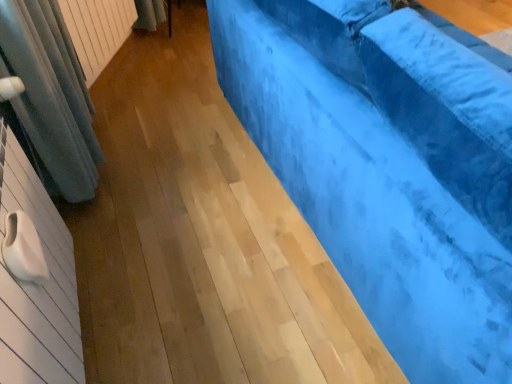
Identify the location of vacant space situated on the left part of velvet blue couch at right. (178, 220).